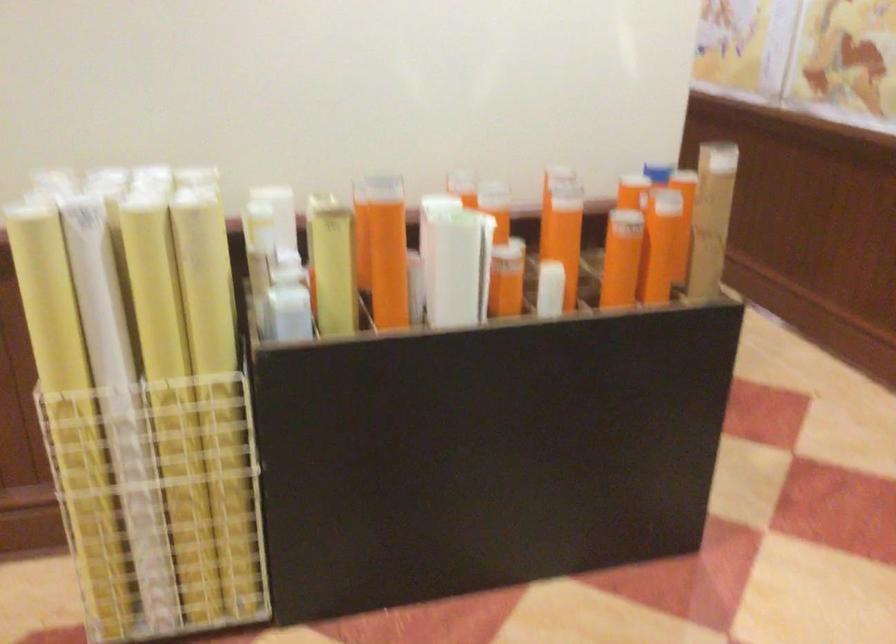
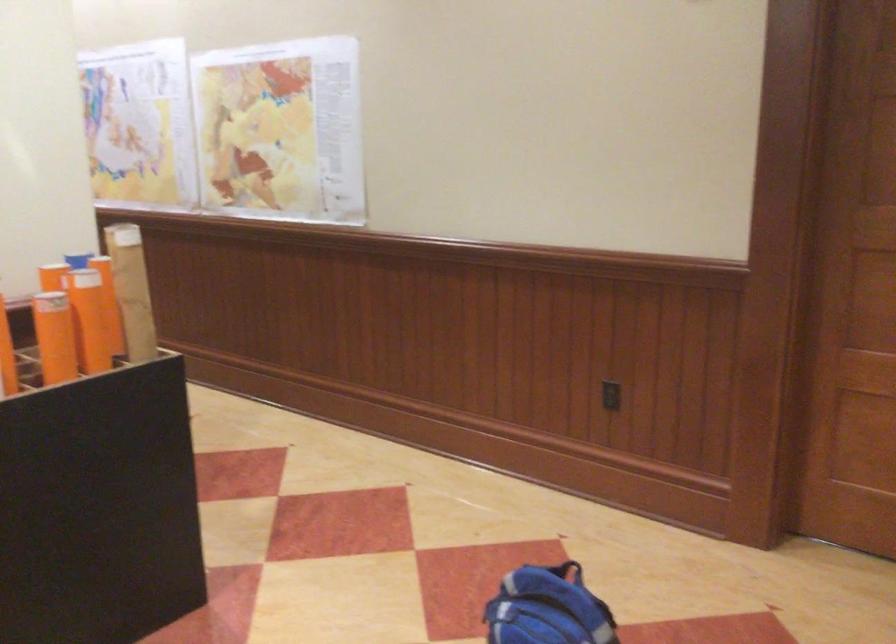
Locate, in the second image, the point that corresponds to point 647,256 in the first image.

(99, 330)